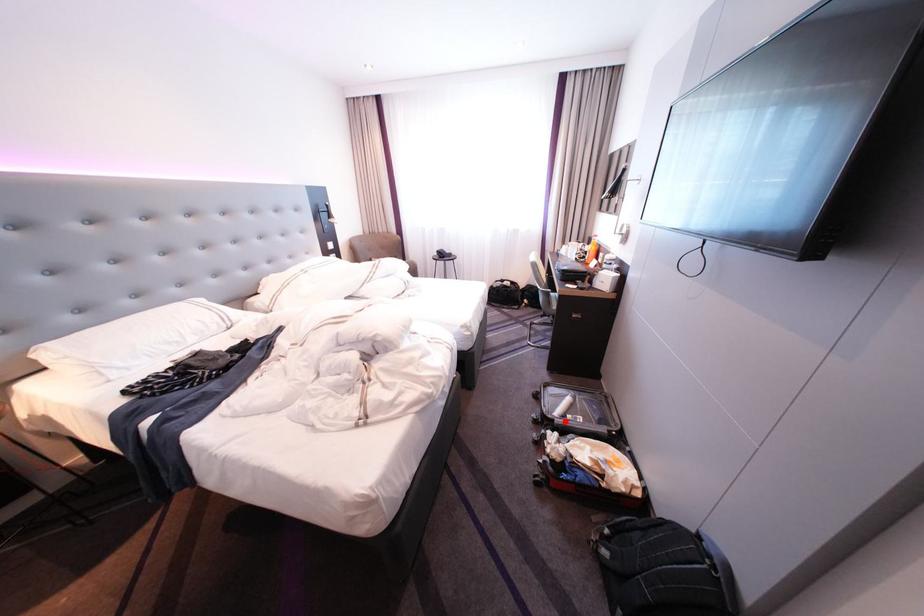
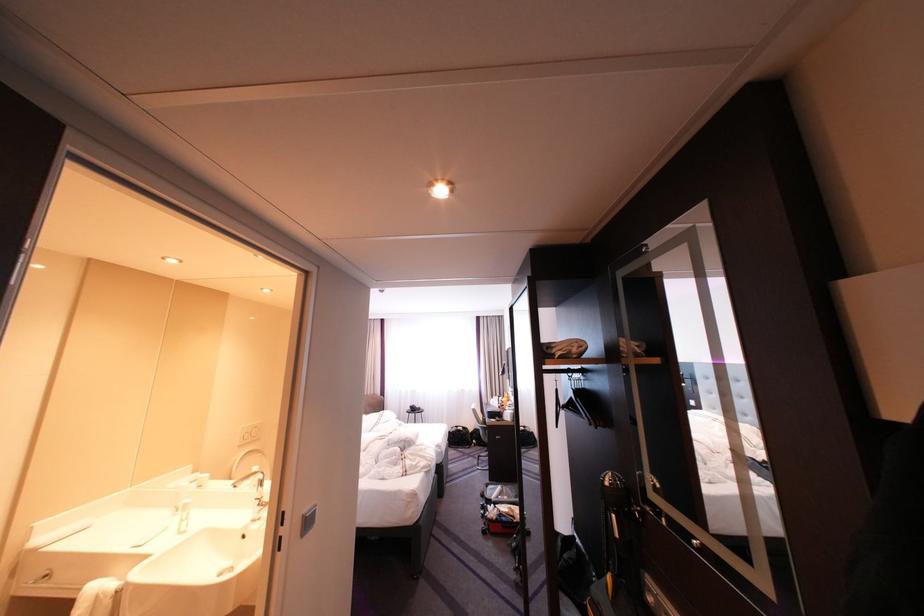
The point at the highlighted location is marked in the first image. Where is the corresponding point in the second image?

(503, 501)